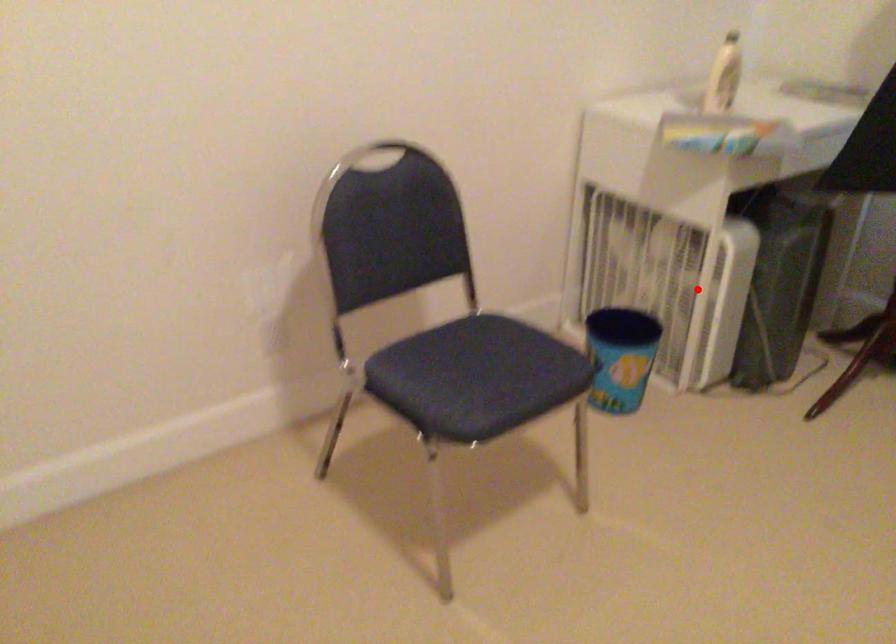
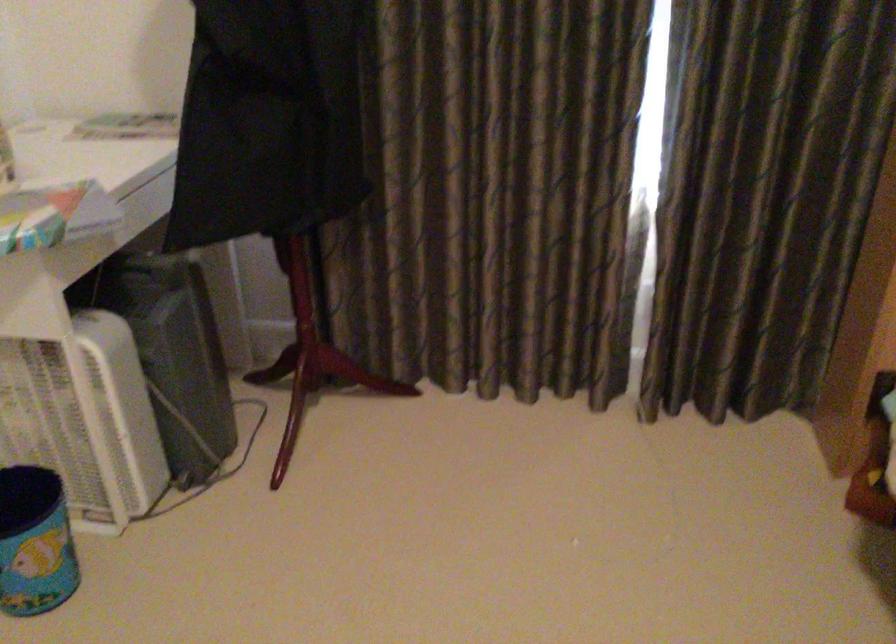
Locate, in the second image, the point that corresponds to the highlighted location in the first image.

(82, 413)